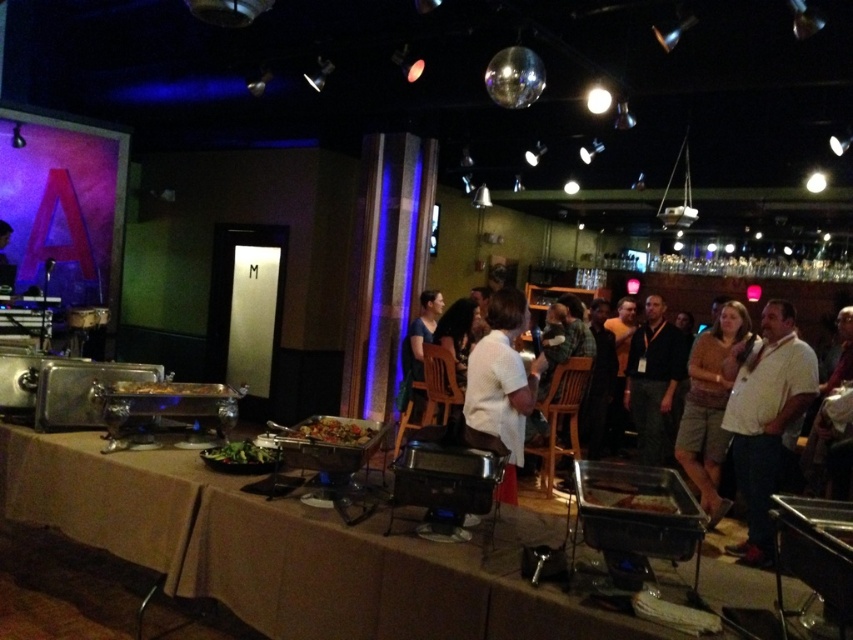
Question: Does brown cotton shirt at center appear on the right side of shiny metallic tray at center?

Choices:
 (A) yes
 (B) no

Answer: (A)

Question: Which is nearer to the brown matte food at lower center?

Choices:
 (A) white shirt at right
 (B) dark blue shirt at center
 (C) green leafy salad at center

Answer: (C)

Question: Which object appears closest to the camera in this image?

Choices:
 (A) dark blue shirt at center
 (B) shiny metallic tray at center

Answer: (B)

Question: Is white matte shirt at center wider than brown matte food at lower center?

Choices:
 (A) yes
 (B) no

Answer: (A)

Question: Which point is closer to the camera?

Choices:
 (A) (515, 403)
 (B) (233, 456)
 (C) (757, 484)
 (D) (781, 333)

Answer: (B)

Question: Does dark gray shirt at center appear over green leafy salad at center?

Choices:
 (A) yes
 (B) no

Answer: (B)